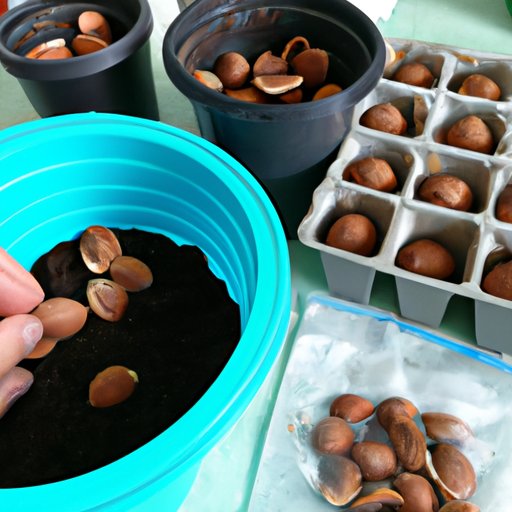
Locate an element on the screen. The image size is (512, 512). planters is located at coordinates (271, 149), (102, 93).